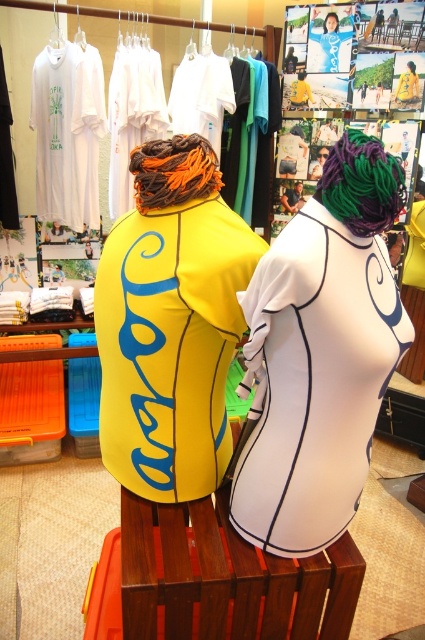
Is multicolored braided hair at center wider than orangehair at center?

No, multicolored braided hair at center is not wider than orangehair at center.

Is point (397, 163) behind point (186, 154)?

No, (397, 163) is in front of (186, 154).

The height and width of the screenshot is (640, 425). What do you see at coordinates (362, 184) in the screenshot?
I see `multicolored braided hair at center` at bounding box center [362, 184].

In order to click on multicolored braided hair at center in this screenshot , I will do `click(362, 184)`.

Is point (357, 141) positioned before point (178, 182)?

Yes, point (357, 141) is in front of point (178, 182).

Is white matte swimsuit at center bigger than orangehair at center?

Yes.

What do you see at coordinates (320, 355) in the screenshot? I see `white matte swimsuit at center` at bounding box center [320, 355].

Locate an element on the screen. Image resolution: width=425 pixels, height=640 pixels. white matte swimsuit at center is located at coordinates (320, 355).

Is white matte swimsuit at center behind yellow matte wetsuit at center?

No.

Does point (260, 321) lie behind point (150, 467)?

That is False.

Image resolution: width=425 pixels, height=640 pixels. In order to click on white matte swimsuit at center in this screenshot , I will do `click(320, 355)`.

Locate an element on the screen. The height and width of the screenshot is (640, 425). white matte swimsuit at center is located at coordinates (320, 355).